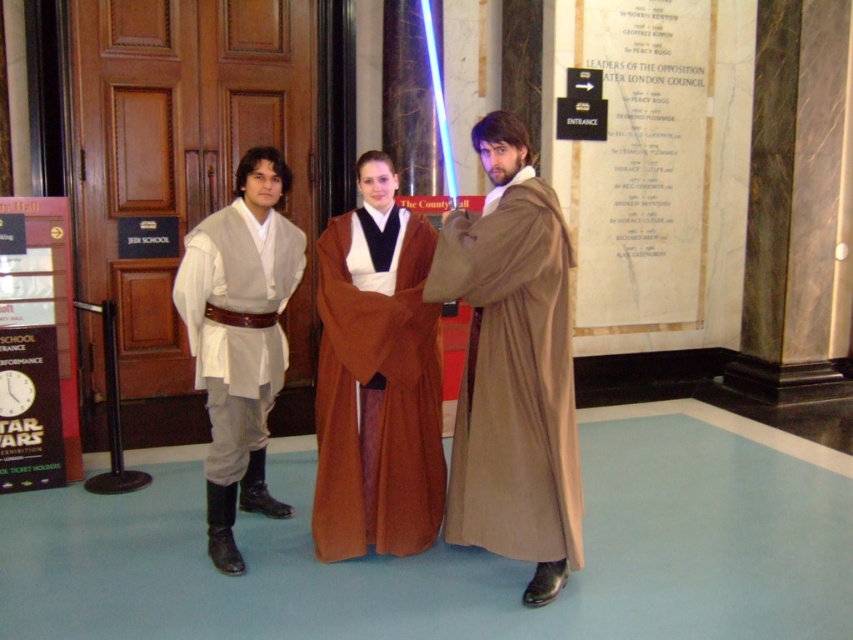
Question: Which point is closer to the camera?

Choices:
 (A) brown satin robe at center
 (B) brown woolen robe at center
 (C) white matte robe at left

Answer: (B)

Question: Does brown woolen robe at center appear under brown satin robe at center?

Choices:
 (A) yes
 (B) no

Answer: (B)

Question: Which of the following is the farthest from the observer?

Choices:
 (A) (473, 342)
 (B) (318, 236)

Answer: (B)

Question: Which point is closer to the camera taking this photo?

Choices:
 (A) (192, 272)
 (B) (352, 355)

Answer: (B)

Question: Considering the relative positions of brown woolen robe at center and white matte robe at left in the image provided, where is brown woolen robe at center located with respect to white matte robe at left?

Choices:
 (A) below
 (B) above

Answer: (A)

Question: Is brown woolen robe at center above brown satin robe at center?

Choices:
 (A) yes
 (B) no

Answer: (A)